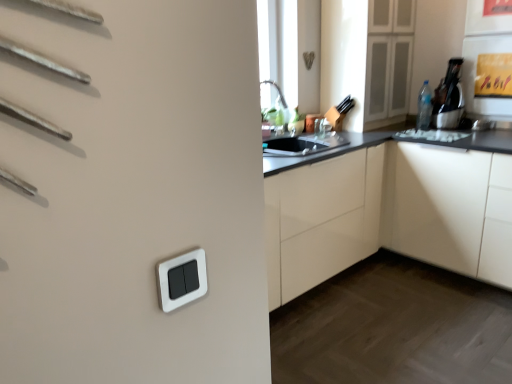
Where is `clear plastic bottle at upper right`? clear plastic bottle at upper right is located at coordinates (424, 107).

The width and height of the screenshot is (512, 384). Describe the element at coordinates (345, 58) in the screenshot. I see `white glossy cabinet at upper right, the second cabinetry when ordered from right to left` at that location.

Describe the element at coordinates (323, 128) in the screenshot. Image resolution: width=512 pixels, height=384 pixels. I see `silver metallic faucet at upper center` at that location.

Locate an element on the screen. This screenshot has width=512, height=384. white plastic light switch at center is located at coordinates (182, 279).

The image size is (512, 384). What do you see at coordinates (321, 220) in the screenshot?
I see `white glossy cabinet at center, the first cabinetry in the left-to-right sequence` at bounding box center [321, 220].

Image resolution: width=512 pixels, height=384 pixels. I want to click on clear plastic bottle at upper right, so click(x=424, y=107).

The image size is (512, 384). I want to click on cabinetry that is below the white glossy cabinet at center, the first cabinetry in the right-to-left sequence (from the image's perspective), so [321, 220].

Is white glossy cabinet at center, the third cabinetry when ordered from left to right, closer to the viewer compared to white glossy cabinet at center, the third cabinetry when ordered from right to left?

No, white glossy cabinet at center, the third cabinetry when ordered from left to right, is further to the viewer.

From the image's perspective, does white glossy cabinet at center, the third cabinetry when ordered from left to right, appear lower than white glossy cabinet at center, the first cabinetry in the left-to-right sequence?

No, from the image's perspective, white glossy cabinet at center, the third cabinetry when ordered from left to right, is not beneath white glossy cabinet at center, the first cabinetry in the left-to-right sequence.

Is white glossy cabinet at center, the first cabinetry in the right-to-left sequence, bigger than white glossy cabinet at center, the third cabinetry when ordered from right to left?

Yes.

Is clear plastic bottle at upper right further to the viewer compared to matte black kettle at upper right?

Yes.

Is clear plastic bottle at upper right to the right of matte black kettle at upper right from the viewer's perspective?

No.

From the image's perspective, is clear plastic bottle at upper right above matte black kettle at upper right?

No, from the image's perspective, clear plastic bottle at upper right is not over matte black kettle at upper right.

Can you see clear plastic bottle at upper right touching matte black kettle at upper right?

No, clear plastic bottle at upper right is not next to matte black kettle at upper right.

From the image's perspective, which one is positioned lower, silver metallic faucet at upper center or clear plastic bottle at upper right?

silver metallic faucet at upper center.

Which is more distant, (328,121) or (428,117)?

Positioned behind is point (428,117).

From a real-world perspective, is silver metallic faucet at upper center physically located above or below clear plastic bottle at upper right?

silver metallic faucet at upper center is situated lower than clear plastic bottle at upper right in the real world.

Based on the photo, from a real-world perspective, between white glossy cabinet at center, the third cabinetry when ordered from left to right, and silver metallic faucet at upper center, who is vertically lower?

white glossy cabinet at center, the third cabinetry when ordered from left to right, from a real-world perspective.

Would you consider white glossy cabinet at center, the first cabinetry in the right-to-left sequence, to be distant from silver metallic faucet at upper center?

No, white glossy cabinet at center, the first cabinetry in the right-to-left sequence, is not far from silver metallic faucet at upper center.

You are a GUI agent. You are given a task and a screenshot of the screen. Output one action in this format:
    pyautogui.click(x=<x>, y=<y>)
    Task: Click on the 2nd cabinetry in front of the silver metallic faucet at upper center
    
    Given the screenshot: What is the action you would take?
    pyautogui.click(x=376, y=208)

From the image's perspective, is matte black kettle at upper right on white glossy cabinet at upper right, the second cabinetry when ordered from right to left?

Actually, matte black kettle at upper right appears below white glossy cabinet at upper right, the second cabinetry when ordered from right to left, in the image.

Who is shorter, matte black kettle at upper right or white glossy cabinet at upper right, the second cabinetry when ordered from right to left?

With less height is matte black kettle at upper right.

The height and width of the screenshot is (384, 512). I want to click on the 1st cabinetry in front when counting from the matte black kettle at upper right, so click(x=345, y=58).

Does white glossy cabinet at center, the third cabinetry when ordered from left to right, contain matte black kettle at upper right?

Actually, matte black kettle at upper right is outside white glossy cabinet at center, the third cabinetry when ordered from left to right.

In terms of width, does white glossy cabinet at center, the first cabinetry in the right-to-left sequence, look wider or thinner when compared to matte black kettle at upper right?

Considering their sizes, white glossy cabinet at center, the first cabinetry in the right-to-left sequence, looks broader than matte black kettle at upper right.

Locate an element on the screen. The image size is (512, 384). the 1st cabinetry counting from the left side of the matte black kettle at upper right is located at coordinates (376, 208).

From the image's perspective, does white glossy cabinet at center, the first cabinetry in the right-to-left sequence, appear lower than matte black kettle at upper right?

Yes.

Is clear plastic bottle at upper right taller than white plastic light switch at center?

Yes.

Considering the sizes of clear plastic bottle at upper right and white plastic light switch at center in the image, is clear plastic bottle at upper right wider or thinner than white plastic light switch at center?

Considering their sizes, clear plastic bottle at upper right looks broader than white plastic light switch at center.

In the image, is clear plastic bottle at upper right positioned in front of or behind white plastic light switch at center?

Visually, clear plastic bottle at upper right is located behind white plastic light switch at center.

Between clear plastic bottle at upper right and white plastic light switch at center, which one has larger size?

clear plastic bottle at upper right.

Locate an element on the screen. The image size is (512, 384). the 1st cabinetry behind the white glossy cabinet at center, the first cabinetry in the left-to-right sequence, counting from the anchor's position is located at coordinates (376, 208).

Identify the location of appliance on the right of clear plastic bottle at upper right. (449, 97).

Based on their spatial positions, is matte black kettle at upper right or white glossy cabinet at center, the third cabinetry when ordered from left to right, closer to clear plastic bottle at upper right?

The object closer to clear plastic bottle at upper right is matte black kettle at upper right.

Considering their positions, is matte black kettle at upper right positioned closer to white plastic light switch at center than silver metallic faucet at upper center?

The object closer to white plastic light switch at center is silver metallic faucet at upper center.

Based on their spatial positions, is silver metallic faucet at upper center or white plastic light switch at center closer to clear plastic bottle at upper right?

Among the two, silver metallic faucet at upper center is located nearer to clear plastic bottle at upper right.

From the image, which object appears to be nearer to clear plastic bottle at upper right, matte black kettle at upper right or white glossy cabinet at upper right, the 2th cabinetry positioned from the left?

Among the two, matte black kettle at upper right is located nearer to clear plastic bottle at upper right.

In the scene shown: When comparing their distances from matte black kettle at upper right, does white glossy cabinet at upper right, the 2th cabinetry positioned from the left, or white plastic light switch at center seem further?

white plastic light switch at center lies further to matte black kettle at upper right than the other object.

Estimate the real-world distances between objects in this image. Which object is further from silver metallic faucet at upper center, white plastic light switch at center or white glossy cabinet at center, the first cabinetry in the right-to-left sequence?

Among the two, white plastic light switch at center is located further to silver metallic faucet at upper center.

Estimate the real-world distances between objects in this image. Which object is closer to clear plastic bottle at upper right, white glossy cabinet at center, the first cabinetry in the right-to-left sequence, or silver metallic faucet at upper center?

silver metallic faucet at upper center.

Which object lies further to the anchor point white glossy cabinet at center, the third cabinetry when ordered from left to right, matte black kettle at upper right or white glossy cabinet at center, the third cabinetry when ordered from right to left?

The object further to white glossy cabinet at center, the third cabinetry when ordered from left to right, is matte black kettle at upper right.

Where is `cabinetry that lies between white glossy cabinet at upper right, the 2th cabinetry positioned from the left, and white glossy cabinet at center, the third cabinetry when ordered from right to left, from top to bottom`? Image resolution: width=512 pixels, height=384 pixels. cabinetry that lies between white glossy cabinet at upper right, the 2th cabinetry positioned from the left, and white glossy cabinet at center, the third cabinetry when ordered from right to left, from top to bottom is located at coordinates (376, 208).

At what (x,y) coordinates should I click in order to perform the action: click on bottle that lies between white glossy cabinet at upper right, the second cabinetry when ordered from right to left, and white glossy cabinet at center, the first cabinetry in the right-to-left sequence, from top to bottom. Please return your answer as a coordinate pair (x, y). Looking at the image, I should click on (424, 107).

Identify the location of bottle between white glossy cabinet at center, the third cabinetry when ordered from right to left, and white glossy cabinet at center, the first cabinetry in the right-to-left sequence, in the horizontal direction. Image resolution: width=512 pixels, height=384 pixels. (424, 107).

The image size is (512, 384). Identify the location of appliance located between white glossy cabinet at center, the third cabinetry when ordered from left to right, and clear plastic bottle at upper right in the depth direction. (449, 97).